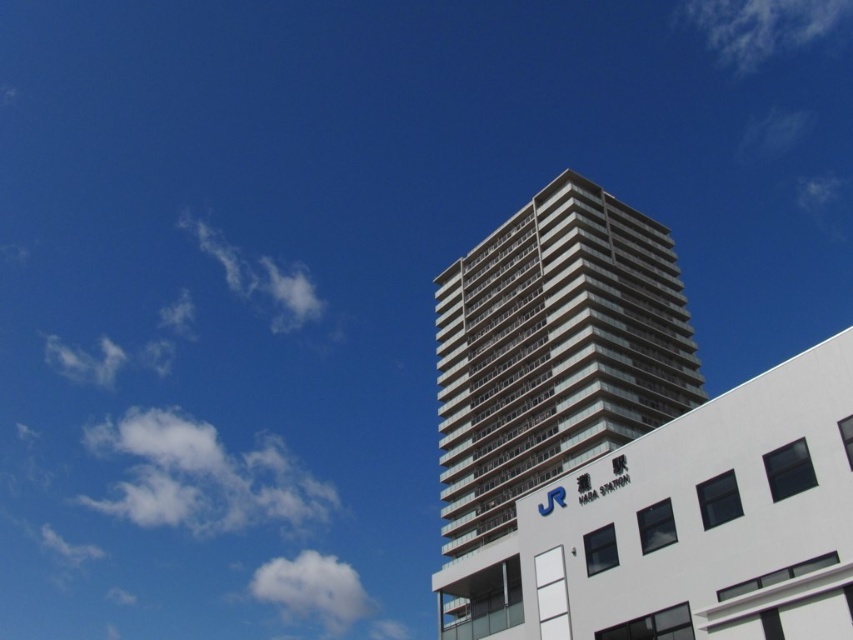
Looking at the urban scene, there are two white fluffy clouds in the sky. Which one is thinner between the white fluffy cloud at lower left and the white fluffy cloud at upper left?

The white fluffy cloud at lower left is thinner than the white fluffy cloud at upper left.

You are a city planner analyzing the urban layout. Given the glassy concrete tower at center and the white fluffy cloud at left, which object occupies a larger horizontal space in the image?

The white fluffy cloud at left occupies a larger horizontal space because the glassy concrete tower at center has a smaller width than the white fluffy cloud at left.

You are standing at the point closest to the residential building. Which of the two points, point [286,467] or point [321,304], is farther from you?

Point [286,467] is farther from you because it is behind point [321,304].